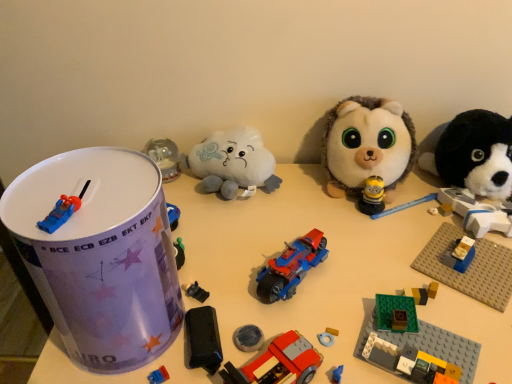
What do you see at coordinates (419, 352) in the screenshot? This screenshot has height=384, width=512. I see `green plastic building block at lower right, which is the 7th toy from left to right` at bounding box center [419, 352].

Measure the distance between shiny plastic toy car at left, arranged as the 2th toy when viewed from the left, and camera.

shiny plastic toy car at left, arranged as the 2th toy when viewed from the left, and camera are 37.97 centimeters apart from each other.

I want to click on black plastic toy car at center, which is the 6th toy in right-to-left order, so click(197, 292).

Image resolution: width=512 pixels, height=384 pixels. Identify the location of green plastic building block at lower right, which is the 7th toy from left to right. (419, 352).

Between blue plastic car at top left, marked as the 1th toy in a left-to-right arrangement, and brick-patterned plastic car at center, which is the 5th toy from right to left, which one has smaller width?

With smaller width is blue plastic car at top left, marked as the 1th toy in a left-to-right arrangement.

Where is `the 5th toy positioned below the blue plastic car at top left, marked as the 1th toy in a left-to-right arrangement (from the image's perspective)`? The height and width of the screenshot is (384, 512). the 5th toy positioned below the blue plastic car at top left, marked as the 1th toy in a left-to-right arrangement (from the image's perspective) is located at coordinates (278, 363).

Looking at this image, considering the positions of objects blue plastic car at top left, positioned as the 9th toy in right-to-left order, and brick-patterned plastic car at center, acting as the 5th toy starting from the left, in the image provided, who is behind, blue plastic car at top left, positioned as the 9th toy in right-to-left order, or brick-patterned plastic car at center, acting as the 5th toy starting from the left,?

brick-patterned plastic car at center, acting as the 5th toy starting from the left.

Between shiny plastic motorcycle at center, which is the sixth toy in left-to-right order, and green plastic building block at lower right, which is the 7th toy from left to right, which one is positioned in front?

green plastic building block at lower right, which is the 7th toy from left to right, is in front.

Is shiny plastic motorcycle at center, which is the sixth toy in left-to-right order, positioned far away from green plastic building block at lower right, which is the 7th toy from left to right?

No.

Between shiny plastic motorcycle at center, the 4th toy viewed from the right, and green plastic building block at lower right, the third toy from the right, which one has larger width?

Wider between the two is green plastic building block at lower right, the third toy from the right.

Is shiny plastic motorcycle at center, which is the sixth toy in left-to-right order, taller than green plastic building block at lower right, which is the 7th toy from left to right?

Yes.

Is black plastic toy car at center, placed as the fourth toy when sorted from left to right, not close to green plastic building block at lower right, which is the 7th toy from left to right?

Actually, black plastic toy car at center, placed as the fourth toy when sorted from left to right, and green plastic building block at lower right, which is the 7th toy from left to right, are a little close together.

Does black plastic toy car at center, which is the 6th toy in right-to-left order, have a greater width compared to green plastic building block at lower right, the third toy from the right?

Incorrect, the width of black plastic toy car at center, which is the 6th toy in right-to-left order, does not surpass that of green plastic building block at lower right, the third toy from the right.

Find the location of a particular element. The height and width of the screenshot is (384, 512). the 1st toy above the green plastic building block at lower right, the third toy from the right (from the image's perspective) is located at coordinates (197, 292).

Who is smaller, fluffy white plush at center, the 2th toy viewed from the right, or blue plastic car at top left, positioned as the 9th toy in right-to-left order?

Smaller between the two is blue plastic car at top left, positioned as the 9th toy in right-to-left order.

Relative to blue plastic car at top left, positioned as the 9th toy in right-to-left order, is fluffy white plush at center, the 2th toy viewed from the right, in front or behind?

fluffy white plush at center, the 2th toy viewed from the right, is positioned farther from the viewer than blue plastic car at top left, positioned as the 9th toy in right-to-left order.

Considering the relative sizes of fluffy white plush at center, the 2th toy viewed from the right, and blue plastic car at top left, positioned as the 9th toy in right-to-left order, in the image provided, is fluffy white plush at center, the 2th toy viewed from the right, shorter than blue plastic car at top left, positioned as the 9th toy in right-to-left order,?

In fact, fluffy white plush at center, the 2th toy viewed from the right, may be taller than blue plastic car at top left, positioned as the 9th toy in right-to-left order.

Considering the positions of point (386, 150) and point (61, 222), is point (386, 150) closer or farther from the camera than point (61, 222)?

Point (386, 150) is positioned farther from the camera compared to point (61, 222).

Can we say brick-patterned plastic car at center, acting as the 5th toy starting from the left, lies outside black plastic toy car at center, placed as the fourth toy when sorted from left to right?

brick-patterned plastic car at center, acting as the 5th toy starting from the left, lies outside black plastic toy car at center, placed as the fourth toy when sorted from left to right,'s area.

Which is in front, brick-patterned plastic car at center, which is the 5th toy from right to left, or black plastic toy car at center, which is the 6th toy in right-to-left order?

brick-patterned plastic car at center, which is the 5th toy from right to left, is more forward.

Where is `toy that is the 2nd one when counting downward from the black plastic toy car at center, placed as the fourth toy when sorted from left to right (from the image's perspective)`? toy that is the 2nd one when counting downward from the black plastic toy car at center, placed as the fourth toy when sorted from left to right (from the image's perspective) is located at coordinates (278, 363).

What's the angular difference between green plastic building block at lower right, which is the 7th toy from left to right, and shiny plastic motorcycle at center, the 4th toy viewed from the right,'s facing directions?

They differ by 42.9 degrees in their facing directions.

Considering the relative sizes of green plastic building block at lower right, the third toy from the right, and shiny plastic motorcycle at center, which is the sixth toy in left-to-right order, in the image provided, is green plastic building block at lower right, the third toy from the right, shorter than shiny plastic motorcycle at center, which is the sixth toy in left-to-right order,?

Indeed, green plastic building block at lower right, the third toy from the right, has a lesser height compared to shiny plastic motorcycle at center, which is the sixth toy in left-to-right order.

Is point (432, 346) more distant than point (300, 247)?

No.

From the image's perspective, is green plastic building block at lower right, the third toy from the right, above or below shiny plastic motorcycle at center, which is the sixth toy in left-to-right order?

Clearly, from the image's perspective, green plastic building block at lower right, the third toy from the right, is below shiny plastic motorcycle at center, which is the sixth toy in left-to-right order.

From the image's perspective, which one is positioned lower, fluffy white plush at center, the 8th toy when ordered from left to right, or shiny plastic toy car at left, the eighth toy positioned from the right?

From the image's view, shiny plastic toy car at left, the eighth toy positioned from the right, is below.

Between fluffy white plush at center, the 8th toy when ordered from left to right, and shiny plastic toy car at left, arranged as the 2th toy when viewed from the left, which one has larger width?

Wider between the two is fluffy white plush at center, the 8th toy when ordered from left to right.

Considering the relative sizes of fluffy white plush at center, the 2th toy viewed from the right, and shiny plastic toy car at left, arranged as the 2th toy when viewed from the left, in the image provided, is fluffy white plush at center, the 2th toy viewed from the right, taller than shiny plastic toy car at left, arranged as the 2th toy when viewed from the left,?

No.

Could you tell me if fluffy white plush at center, the 2th toy viewed from the right, is turned towards shiny plastic toy car at left, the eighth toy positioned from the right?

No, fluffy white plush at center, the 2th toy viewed from the right, is not turned towards shiny plastic toy car at left, the eighth toy positioned from the right.

Which toy is the 1st one when counting from the front of the brick-patterned plastic car at center, acting as the 5th toy starting from the left? Please provide its 2D coordinates.

[(62, 211)]

Where is `the 2nd toy positioned below the shiny plastic motorcycle at center, which is the sixth toy in left-to-right order (from the image's perspective)`? The height and width of the screenshot is (384, 512). the 2nd toy positioned below the shiny plastic motorcycle at center, which is the sixth toy in left-to-right order (from the image's perspective) is located at coordinates (419, 352).

Considering their positions, is black plush dog at right, positioned as the 1th toy in right-to-left order, positioned closer to white plush cloud at center, which appears as the seventh toy when viewed from the right, than shiny plastic motorcycle at center, which is the sixth toy in left-to-right order?

The object closer to white plush cloud at center, which appears as the seventh toy when viewed from the right, is shiny plastic motorcycle at center, which is the sixth toy in left-to-right order.

Considering their positions, is white plush cloud at center, which is the third toy in left-to-right order, positioned further to fluffy white plush at center, the 2th toy viewed from the right, than green plastic building block at lower right, which is the 7th toy from left to right?

green plastic building block at lower right, which is the 7th toy from left to right, is positioned further to the anchor fluffy white plush at center, the 2th toy viewed from the right.

Estimate the real-world distances between objects in this image. Which object is closer to shiny plastic toy car at left, arranged as the 2th toy when viewed from the left, white plush cloud at center, which appears as the seventh toy when viewed from the right, or shiny plastic motorcycle at center, which is the sixth toy in left-to-right order?

shiny plastic motorcycle at center, which is the sixth toy in left-to-right order, lies closer to shiny plastic toy car at left, arranged as the 2th toy when viewed from the left, than the other object.

From the image, which object appears to be nearer to black plush dog at right, positioned as the 1th toy in right-to-left order, green plastic building block at lower right, which is the 7th toy from left to right, or blue plastic car at top left, marked as the 1th toy in a left-to-right arrangement?

green plastic building block at lower right, which is the 7th toy from left to right, is positioned closer to the anchor black plush dog at right, positioned as the 1th toy in right-to-left order.

Considering their positions, is blue plastic car at top left, positioned as the 9th toy in right-to-left order, positioned closer to white plush cloud at center, which is the third toy in left-to-right order, than shiny plastic toy car at left, the eighth toy positioned from the right?

The object closer to white plush cloud at center, which is the third toy in left-to-right order, is shiny plastic toy car at left, the eighth toy positioned from the right.

From the picture: Which object lies further to the anchor point fluffy white plush at center, the 2th toy viewed from the right, shiny plastic motorcycle at center, which is the sixth toy in left-to-right order, or shiny plastic toy car at left, arranged as the 2th toy when viewed from the left?

Among the two, shiny plastic toy car at left, arranged as the 2th toy when viewed from the left, is located further to fluffy white plush at center, the 2th toy viewed from the right.

From the image, which object appears to be nearer to black plush dog at right, positioned as the 1th toy in right-to-left order, shiny plastic toy car at left, the eighth toy positioned from the right, or brick-patterned plastic car at center, which is the 5th toy from right to left?

Among the two, brick-patterned plastic car at center, which is the 5th toy from right to left, is located nearer to black plush dog at right, positioned as the 1th toy in right-to-left order.

Considering their positions, is shiny plastic toy car at left, the eighth toy positioned from the right, positioned further to brick-patterned plastic car at center, which is the 5th toy from right to left, than white plush cloud at center, which appears as the seventh toy when viewed from the right?

white plush cloud at center, which appears as the seventh toy when viewed from the right, is further to brick-patterned plastic car at center, which is the 5th toy from right to left.

Locate an element on the screen. The height and width of the screenshot is (384, 512). toy between brick-patterned plastic car at center, which is the 5th toy from right to left, and green plastic building block at lower right, which is the 7th toy from left to right, in the horizontal direction is located at coordinates (291, 267).